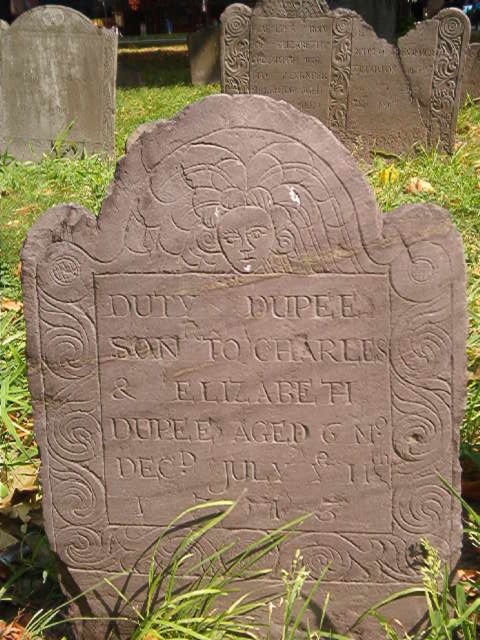
In the scene shown: Is black stone inscription at center to the left of dark gray stone gravestone at upper center from the viewer's perspective?

Correct, you'll find black stone inscription at center to the left of dark gray stone gravestone at upper center.

Locate an element on the screen. Image resolution: width=480 pixels, height=640 pixels. black stone inscription at center is located at coordinates (245, 387).

Who is more distant from viewer, (284,353) or (369,29)?

The point (369,29) is more distant.

This screenshot has height=640, width=480. Find the location of `black stone inscription at center`. black stone inscription at center is located at coordinates (245, 387).

In the scene shown: Can you confirm if dark gray stone gravestone at upper center is shorter than dark gray stone gravestone at upper left?

Yes.

Does point (415, 26) come in front of point (34, 134)?

No, it is not.

This screenshot has width=480, height=640. I want to click on dark gray stone gravestone at upper center, so pos(350,70).

Is point (300, 454) more distant than point (62, 10)?

No, it is in front of (62, 10).

Between black stone inscription at center and dark gray stone gravestone at upper left, which one has less height?

Standing shorter between the two is black stone inscription at center.

Which is in front, point (371, 321) or point (60, 125)?

Positioned in front is point (371, 321).

Identify the location of black stone inscription at center. The width and height of the screenshot is (480, 640). (245, 387).